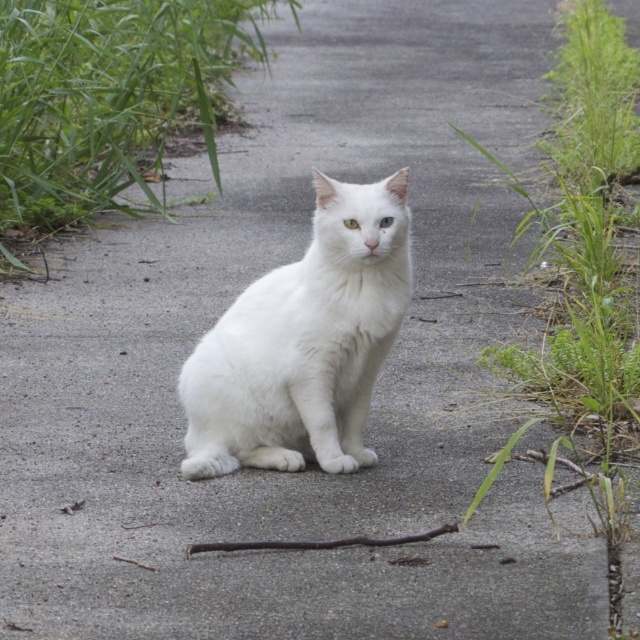
Question: Which of these objects is positioned closest to the white fluffy cat at center?

Choices:
 (A) green leafy grass at upper right
 (B) green leafy grass at upper left

Answer: (A)

Question: Is green leafy grass at upper left bigger than white fluffy cat at center?

Choices:
 (A) no
 (B) yes

Answer: (B)

Question: Which point appears farthest from the camera in this image?

Choices:
 (A) (608, 173)
 (B) (346, 406)

Answer: (A)

Question: Among these objects, which one is farthest from the camera?

Choices:
 (A) green leafy grass at upper right
 (B) green leafy grass at upper left

Answer: (B)

Question: Can you confirm if white fluffy cat at center is wider than green leafy grass at upper right?

Choices:
 (A) no
 (B) yes

Answer: (A)

Question: Can you confirm if green leafy grass at upper left is positioned below green leafy grass at upper right?

Choices:
 (A) yes
 (B) no

Answer: (A)